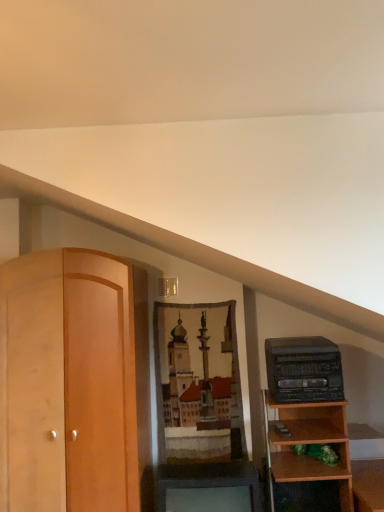
You are a GUI agent. You are given a task and a screenshot of the screen. Output one action in this format:
    pyautogui.click(x=<x>, y=<y>)
    Task: Click on the matte black cabinet at lower center
    The height and width of the screenshot is (512, 384).
    Given the screenshot: What is the action you would take?
    208,479

Describe the element at coordinates (208, 479) in the screenshot. The image size is (384, 512). I see `matte black cabinet at lower center` at that location.

What do you see at coordinates (304, 370) in the screenshot? The width and height of the screenshot is (384, 512). I see `black plastic stereo at right` at bounding box center [304, 370].

Identify the location of black plastic stereo at right. (304, 370).

Measure the distance between point (273, 338) and camera.

The distance of point (273, 338) from camera is 2.93 meters.

Image resolution: width=384 pixels, height=512 pixels. In order to click on matte black cabinet at lower center in this screenshot , I will do `click(208, 479)`.

Considering the positions of objects matte black cabinet at lower center and black plastic stereo at right in the image provided, who is more to the right, matte black cabinet at lower center or black plastic stereo at right?

From the viewer's perspective, black plastic stereo at right appears more on the right side.

Between matte black cabinet at lower center and black plastic stereo at right, which one is positioned in front?

Positioned in front is matte black cabinet at lower center.

Which point is more distant from viewer, (251, 495) or (311, 386)?

Point (251, 495)

From the image's perspective, between matte black cabinet at lower center and black plastic stereo at right, who is located below?

matte black cabinet at lower center appears lower in the image.

From a real-world perspective, is matte black cabinet at lower center positioned above or below black plastic stereo at right?

In terms of real-world spatial position, matte black cabinet at lower center is below black plastic stereo at right.

From the picture: Which of these two, matte black cabinet at lower center or black plastic stereo at right, is wider?

Wider between the two is matte black cabinet at lower center.

Does matte black cabinet at lower center have a lesser height compared to black plastic stereo at right?

In fact, matte black cabinet at lower center may be taller than black plastic stereo at right.

Considering the sizes of matte black cabinet at lower center and black plastic stereo at right in the image, is matte black cabinet at lower center bigger or smaller than black plastic stereo at right?

In the image, matte black cabinet at lower center appears to be larger than black plastic stereo at right.

Is matte black cabinet at lower center inside the boundaries of black plastic stereo at right, or outside?

matte black cabinet at lower center is not enclosed by black plastic stereo at right.

Is matte black cabinet at lower center not near black plastic stereo at right?

That's not correct — matte black cabinet at lower center is a little close to black plastic stereo at right.

Is matte black cabinet at lower center oriented away from black plastic stereo at right?

No.

What's the angular difference between matte black cabinet at lower center and black plastic stereo at right's facing directions?

matte black cabinet at lower center and black plastic stereo at right are facing 1.59 degrees away from each other.

Identify the location of cabinetry lying on the left of black plastic stereo at right. The width and height of the screenshot is (384, 512). (208, 479).

Is black plastic stereo at right to the left or to the right of matte black cabinet at lower center in the image?

black plastic stereo at right is to the right of matte black cabinet at lower center.

Who is more distant, black plastic stereo at right or matte black cabinet at lower center?

black plastic stereo at right.

Which point is more forward, (288,345) or (159,497)?

The point (159,497) is closer to the camera.

From the image's perspective, which object appears higher, black plastic stereo at right or matte black cabinet at lower center?

From the image's view, black plastic stereo at right is above.

From a real-world perspective, is black plastic stereo at right over matte black cabinet at lower center?

Yes, from a real-world perspective, black plastic stereo at right is above matte black cabinet at lower center.

Considering the relative sizes of black plastic stereo at right and matte black cabinet at lower center in the image provided, is black plastic stereo at right wider than matte black cabinet at lower center?

In fact, black plastic stereo at right might be narrower than matte black cabinet at lower center.

Between black plastic stereo at right and matte black cabinet at lower center, which one has less height?

black plastic stereo at right.

Which of these two, black plastic stereo at right or matte black cabinet at lower center, is smaller?

black plastic stereo at right is smaller.

Is black plastic stereo at right completely or partially outside of matte black cabinet at lower center?

Absolutely, black plastic stereo at right is external to matte black cabinet at lower center.

Is black plastic stereo at right next to matte black cabinet at lower center?

No, black plastic stereo at right is not next to matte black cabinet at lower center.

Is black plastic stereo at right turned away from matte black cabinet at lower center?

No, black plastic stereo at right is not facing the opposite direction of matte black cabinet at lower center.

Can you tell me how much black plastic stereo at right and matte black cabinet at lower center differ in facing direction?

1.59 degrees separate the facing orientations of black plastic stereo at right and matte black cabinet at lower center.

At what (x,y) coordinates should I click in order to perform the action: click on cabinetry below the black plastic stereo at right (from a real-world perspective). Please return your answer as a coordinate pair (x, y). The image size is (384, 512). Looking at the image, I should click on (208, 479).

The height and width of the screenshot is (512, 384). Identify the location of stereo that is above the matte black cabinet at lower center (from the image's perspective). (304, 370).

The width and height of the screenshot is (384, 512). In order to click on cabinetry to the left of black plastic stereo at right in this screenshot , I will do `click(208, 479)`.